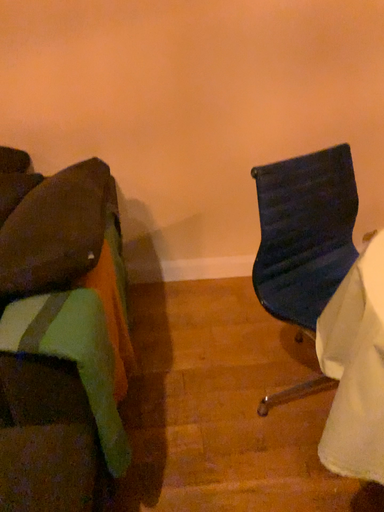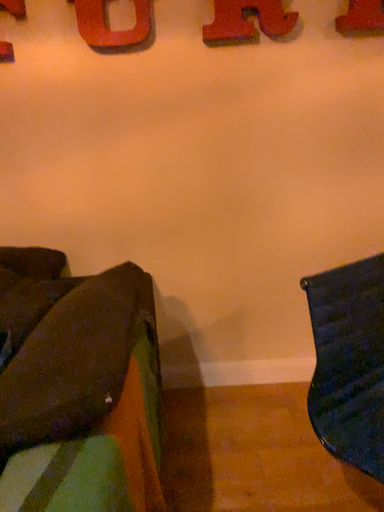
Question: How did the camera likely rotate when shooting the video?

Choices:
 (A) rotated upward
 (B) rotated downward

Answer: (A)